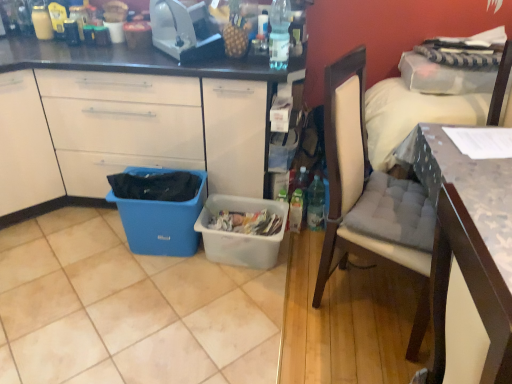
What do you see at coordinates (468, 241) in the screenshot?
I see `wooden textured desk at right` at bounding box center [468, 241].

Measure the distance between point (143, 40) and camera.

2.11 meters.

I want to click on beige tile at lower left, so coord(129,309).

From the picture: What is the approximate width of clear plastic bottle at upper center?

The width of clear plastic bottle at upper center is 5.89 inches.

This screenshot has height=384, width=512. I want to click on white fabric pillow at upper right, so click(444, 76).

Identify the location of wooden textured desk at right. (468, 241).

Is there a large distance between white fabric pillow at upper right and white matte cabinet at left?

white fabric pillow at upper right is near white matte cabinet at left, not far away.

Is white fabric pillow at upper right to the left of white matte cabinet at left from the viewer's perspective?

No, white fabric pillow at upper right is not to the left of white matte cabinet at left.

Is white fabric pillow at upper right inside the boundaries of white matte cabinet at left, or outside?

white fabric pillow at upper right lies outside white matte cabinet at left.

From a real-world perspective, is beige tile at lower left physically below matte black coffee cup at upper center?

Yes.

Which is less distant, (218, 330) or (134, 25)?

The point (218, 330) is in front.

Based on the photo, which object is closer to the camera taking this photo, beige tile at lower left or matte black coffee cup at upper center?

beige tile at lower left is in front.

Is beige tile at lower left turned away from matte black coffee cup at upper center?

That's not correct — beige tile at lower left is not looking away from matte black coffee cup at upper center.

Does translucent plastic picnic basket at center turn towards light beige fabric chair at right?

No, translucent plastic picnic basket at center is not aimed at light beige fabric chair at right.

From the image's perspective, which is above, translucent plastic picnic basket at center or light beige fabric chair at right?

light beige fabric chair at right.

From a real-world perspective, between translucent plastic picnic basket at center and light beige fabric chair at right, who is vertically higher?

From a 3D spatial view, light beige fabric chair at right is above.

Is there a large distance between translucent plastic picnic basket at center and light beige fabric chair at right?

translucent plastic picnic basket at center is near light beige fabric chair at right, not far away.

How far apart are blue plastic trash can at lower left and matte black coffee cup at upper center?

84.17 centimeters.

Is blue plastic trash can at lower left touching matte black coffee cup at upper center?

blue plastic trash can at lower left is not next to matte black coffee cup at upper center, and they're not touching.

Find the location of a particular element. This screenshot has height=384, width=512. coffee cup above the blue plastic trash can at lower left (from a real-world perspective) is located at coordinates (138, 34).

Is blue plastic trash can at lower left facing towards matte black coffee cup at upper center?

No, blue plastic trash can at lower left is not oriented towards matte black coffee cup at upper center.

This screenshot has width=512, height=384. Find the location of `coffee cup above the wooden textured desk at right (from a real-world perspective)`. coffee cup above the wooden textured desk at right (from a real-world perspective) is located at coordinates (138, 34).

Are wooden textured desk at right and matte black coffee cup at upper center far apart?

Yes.

From the image's perspective, who appears lower, light beige fabric chair at right or blue plastic bin at lower left?

light beige fabric chair at right appears lower in the image.

Between light beige fabric chair at right and blue plastic bin at lower left, which one appears on the left side from the viewer's perspective?

From the viewer's perspective, blue plastic bin at lower left appears more on the left side.

Is point (357, 136) less distant than point (79, 151)?

Yes, point (357, 136) is in front of point (79, 151).

Does light beige fabric chair at right lie behind blue plastic bin at lower left?

That is False.

Is translucent plastic picnic basket at center situated inside clear plastic bottle at upper center or outside?

translucent plastic picnic basket at center is not inside clear plastic bottle at upper center, it's outside.

Does translucent plastic picnic basket at center have a smaller size compared to clear plastic bottle at upper center?

No.

From a real-world perspective, who is located higher, translucent plastic picnic basket at center or clear plastic bottle at upper center?

clear plastic bottle at upper center.

Find the location of a particular element. The width and height of the screenshot is (512, 384). cabinetry located below the white fabric pillow at upper right (from the image's perspective) is located at coordinates (144, 67).

The width and height of the screenshot is (512, 384). There is a beige tile at lower left. Identify the location of coffee cup above it (from a real-world perspective). (138, 34).

Looking at the image, which one is located further to blue plastic trash can at lower left, light beige fabric chair at right or beige tile at lower left?

light beige fabric chair at right lies further to blue plastic trash can at lower left than the other object.

From the picture: When comparing their distances from translucent plastic picnic basket at center, does beige tile at lower left or white fabric pillow at upper right seem closer?

beige tile at lower left is closer to translucent plastic picnic basket at center.

Based on their spatial positions, is blue plastic bin at lower left or white fabric pillow at upper right further from white matte cabinet at left?

Based on the image, white fabric pillow at upper right appears to be further to white matte cabinet at left.

Estimate the real-world distances between objects in this image. Which object is further from clear plastic bottle at upper center, white matte cabinet at left or translucent plastic picnic basket at center?

translucent plastic picnic basket at center.

From the image, which object appears to be farther from clear plastic bottle at upper center, translucent plastic picnic basket at center or matte black coffee cup at upper center?

Among the two, translucent plastic picnic basket at center is located further to clear plastic bottle at upper center.

Based on the photo, looking at the image, which one is located further to wooden textured desk at right, matte black coffee cup at upper center or white fabric pillow at upper right?

The object further to wooden textured desk at right is matte black coffee cup at upper center.

Considering their positions, is wooden textured desk at right positioned closer to beige tile at lower left than clear plastic bottle at upper center?

Based on the image, wooden textured desk at right appears to be nearer to beige tile at lower left.

From the image, which object appears to be farther from translucent plastic picnic basket at center, blue plastic trash can at lower left or matte black coffee cup at upper center?

matte black coffee cup at upper center is further to translucent plastic picnic basket at center.

I want to click on cabinetry between blue plastic trash can at lower left and white fabric pillow at upper right in the horizontal direction, so click(x=144, y=67).

Where is `toaster between beige tile at lower left and wooden textured desk at right in the horizontal direction`? This screenshot has height=384, width=512. toaster between beige tile at lower left and wooden textured desk at right in the horizontal direction is located at coordinates [184, 31].

Where is `cabinetry between clear plastic bottle at upper center and blue plastic trash can at lower left in the vertical direction`? This screenshot has width=512, height=384. cabinetry between clear plastic bottle at upper center and blue plastic trash can at lower left in the vertical direction is located at coordinates (144, 67).

You are a GUI agent. You are given a task and a screenshot of the screen. Output one action in this format:
    pyautogui.click(x=<x>, y=<y>)
    Task: Click on the picnic basket between light beige fabric chair at right and matte black coffee cup at upper center from front to back
    The width and height of the screenshot is (512, 384).
    Given the screenshot: What is the action you would take?
    pyautogui.click(x=241, y=234)